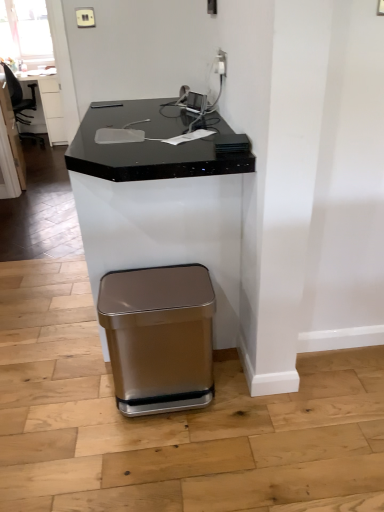
Question: Is point (110, 123) closer or farther from the camera than point (46, 114)?

Choices:
 (A) closer
 (B) farther

Answer: (A)

Question: Considering the positions of black granite desk at center and black granite table at upper left in the image, is black granite desk at center bigger or smaller than black granite table at upper left?

Choices:
 (A) big
 (B) small

Answer: (A)

Question: Based on their relative distances, which object is farther from the black leather swivel chair at left?

Choices:
 (A) black granite desk at center
 (B) black granite table at upper left
 (C) satin gold trash can at lower center
 (D) satin gold outlet at upper center

Answer: (D)

Question: Which is farther from the black leather swivel chair at left?

Choices:
 (A) satin gold trash can at lower center
 (B) black granite table at upper left
 (C) satin gold outlet at upper center
 (D) black granite desk at center

Answer: (C)